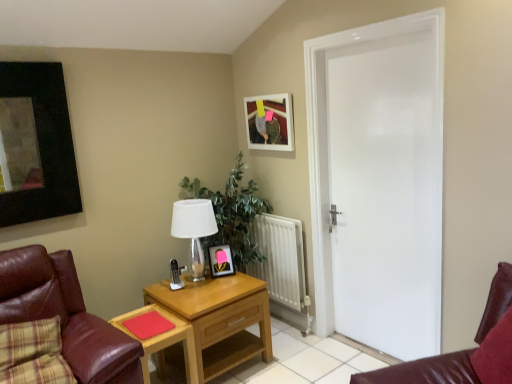
Question: Is wooden table at center oriented away from matte black picture frame at center, the 2th picture frame from the right?

Choices:
 (A) no
 (B) yes

Answer: (A)

Question: Is wooden table at center outside matte black picture frame at center, the 2th picture frame from the right?

Choices:
 (A) no
 (B) yes

Answer: (B)

Question: Can you confirm if wooden table at center is wider than matte black picture frame at center, placed as the 2th picture frame when sorted from top to bottom?

Choices:
 (A) no
 (B) yes

Answer: (B)

Question: From a real-world perspective, is wooden table at center under matte black picture frame at center, the 2th picture frame from the right?

Choices:
 (A) yes
 (B) no

Answer: (A)

Question: Considering the relative sizes of wooden table at center and matte black picture frame at center, the 2th picture frame from the right, in the image provided, is wooden table at center thinner than matte black picture frame at center, the 2th picture frame from the right,?

Choices:
 (A) no
 (B) yes

Answer: (A)

Question: Considering the relative positions of wooden table at center and matte black picture frame at center, which is counted as the first picture frame, starting from the bottom, in the image provided, is wooden table at center behind matte black picture frame at center, which is counted as the first picture frame, starting from the bottom,?

Choices:
 (A) no
 (B) yes

Answer: (A)

Question: Would you say leather at left is a long distance from white glossy door at right?

Choices:
 (A) no
 (B) yes

Answer: (B)

Question: From the image's perspective, is leather at left on top of white glossy door at right?

Choices:
 (A) no
 (B) yes

Answer: (A)

Question: Is leather at left shorter than white glossy door at right?

Choices:
 (A) no
 (B) yes

Answer: (B)

Question: Is white glossy door at right a part of leather at left?

Choices:
 (A) yes
 (B) no

Answer: (B)

Question: From the image's perspective, would you say leather at left is shown under white glossy door at right?

Choices:
 (A) yes
 (B) no

Answer: (A)

Question: Is leather at left next to white glossy door at right and touching it?

Choices:
 (A) no
 (B) yes

Answer: (A)

Question: Is matte black picture frame at center, placed as the 2th picture frame when sorted from top to bottom, at the back of wooden nightstand at center?

Choices:
 (A) no
 (B) yes

Answer: (A)